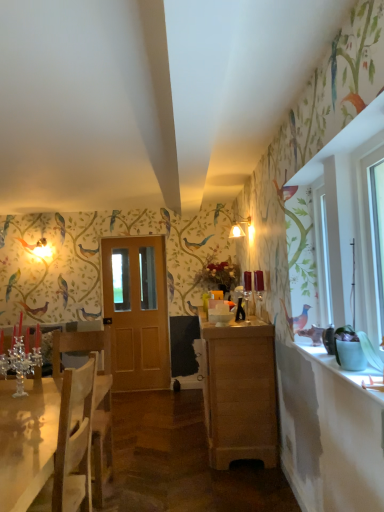
Question: From a real-world perspective, is white glossy counter top at right located beneath matte white lampshade at center?

Choices:
 (A) yes
 (B) no

Answer: (A)

Question: Is white glossy counter top at right not near matte white lampshade at center?

Choices:
 (A) no
 (B) yes

Answer: (B)

Question: From a real-world perspective, is white glossy counter top at right on top of matte white lampshade at center?

Choices:
 (A) no
 (B) yes

Answer: (A)

Question: Considering the relative positions of white glossy counter top at right and matte white lampshade at center in the image provided, is white glossy counter top at right to the right of matte white lampshade at center from the viewer's perspective?

Choices:
 (A) no
 (B) yes

Answer: (B)

Question: Are white glossy counter top at right and matte white lampshade at center making contact?

Choices:
 (A) yes
 (B) no

Answer: (B)

Question: Does white glossy counter top at right have a greater height compared to matte white lampshade at center?

Choices:
 (A) yes
 (B) no

Answer: (B)

Question: Is white wood frame at right completely or partially outside of light brown wooden door at center?

Choices:
 (A) no
 (B) yes

Answer: (B)

Question: Is white wood frame at right at the left side of light brown wooden door at center?

Choices:
 (A) no
 (B) yes

Answer: (A)

Question: Considering the relative sizes of white wood frame at right and light brown wooden door at center in the image provided, is white wood frame at right smaller than light brown wooden door at center?

Choices:
 (A) no
 (B) yes

Answer: (B)

Question: From the image's perspective, is white wood frame at right located beneath light brown wooden door at center?

Choices:
 (A) yes
 (B) no

Answer: (B)

Question: Are white wood frame at right and light brown wooden door at center far apart?

Choices:
 (A) yes
 (B) no

Answer: (A)

Question: From the image's perspective, is white wood frame at right located above light brown wooden door at center?

Choices:
 (A) yes
 (B) no

Answer: (A)

Question: Is light brown wood cabinet at center to the right of matte white lampshade at center from the viewer's perspective?

Choices:
 (A) yes
 (B) no

Answer: (B)